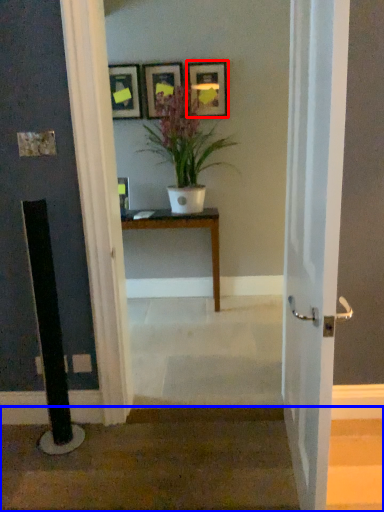
Question: Which object is further to the camera taking this photo, picture frame (highlighted by a red box) or stairwell (highlighted by a blue box)?

Choices:
 (A) picture frame
 (B) stairwell

Answer: (A)